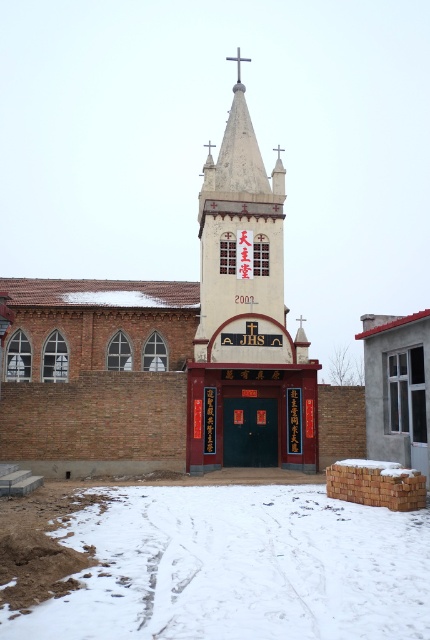
Question: Is white powdery snow at lower center wider than white stucco church tower at center?

Choices:
 (A) yes
 (B) no

Answer: (A)

Question: Which object appears farthest from the camera in this image?

Choices:
 (A) white stucco church tower at center
 (B) white plastic cross at upper center
 (C) white powdery snow at lower center

Answer: (B)

Question: Is white stucco church tower at center to the left of white plastic cross at upper center from the viewer's perspective?

Choices:
 (A) no
 (B) yes

Answer: (B)

Question: Which point is farther to the camera?

Choices:
 (A) (227, 177)
 (B) (40, 612)

Answer: (A)

Question: Can you confirm if white stucco church tower at center is positioned to the right of white plastic cross at upper center?

Choices:
 (A) no
 (B) yes

Answer: (A)

Question: Among these objects, which one is nearest to the camera?

Choices:
 (A) white plastic cross at upper center
 (B) white stucco church tower at center

Answer: (B)